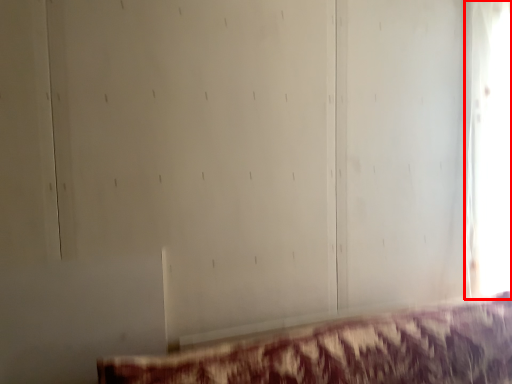
Question: From the image's perspective, where is window (annotated by the red box) located relative to furniture?

Choices:
 (A) above
 (B) below

Answer: (A)